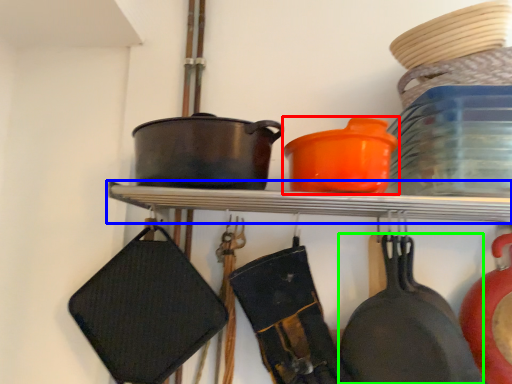
Question: Based on their relative distances, which object is farther from tableware (highlighted by a red box)? Choose from shelf (highlighted by a blue box) and frying pan (highlighted by a green box).

Choices:
 (A) shelf
 (B) frying pan

Answer: (B)